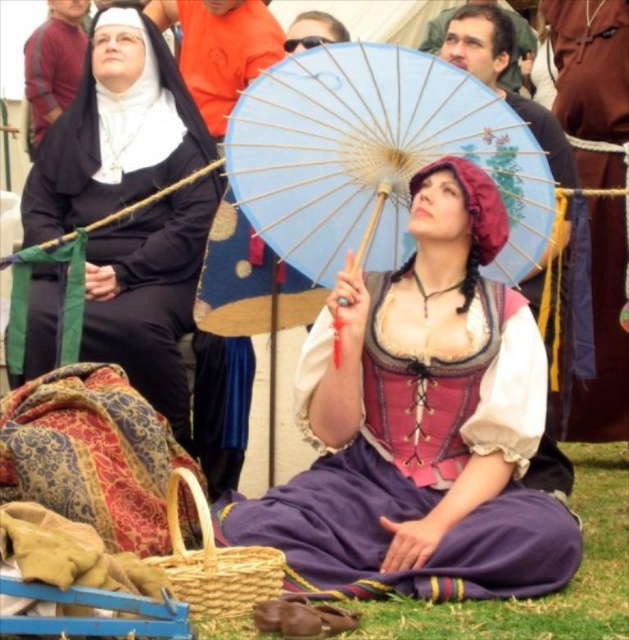
You are a costume designer observing the Renaissance festival scene. You need to determine the spatial arrangement of the purple satin dress at center and the brown leather belt at upper center. Which object is located to the left of the other?

The purple satin dress at center is positioned on the left side of brown leather belt at upper center.

You are a costume designer observing the historical reenactment scene. You need to determine which item takes up more space in the visual composition. Which object is larger in size between the matte pink fabric dress at center and the blue paper umbrella at center?

The matte pink fabric dress at center is larger in size compared to the blue paper umbrella at center, so the dress takes up more space in the visual composition.